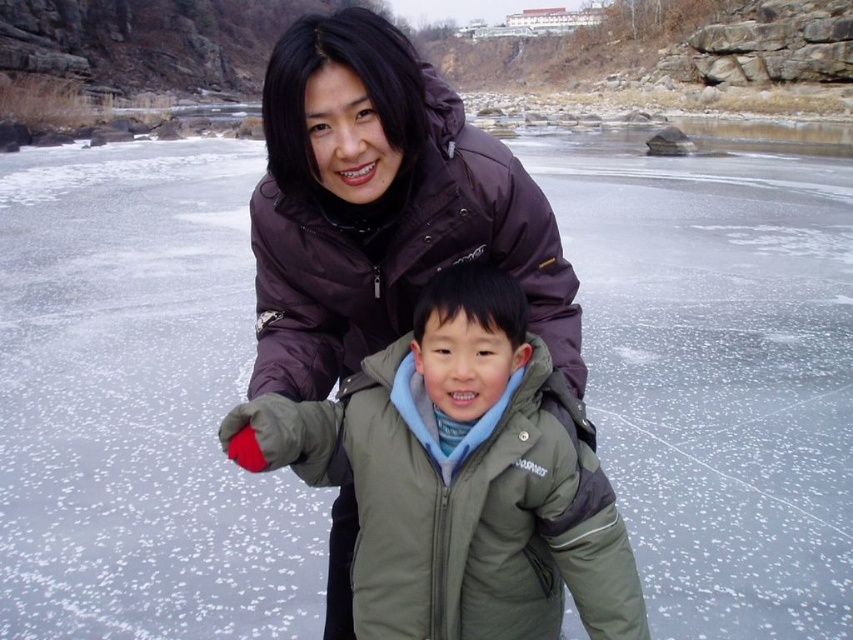
In the winter scene, there is a woman in a dark purple puffer jacket and a boy in a green fuzzy jacket at center. Where exactly is the green fuzzy jacket located in terms of coordinates?

The green fuzzy jacket at center is located at point coordinates of [460,476].

You are a photographer trying to capture a photo of both the green fuzzy jacket at center and the dark purple down jacket at center. Which jacket will appear larger in the photo if you focus on the closer one?

The dark purple down jacket at center will appear larger in the photo because it is taller than the green fuzzy jacket at center.

You are a photographer trying to capture both the green fuzzy jacket at center and the dark purple down jacket at center in the same frame. Which jacket should you focus on first to ensure both are in the frame?

The green fuzzy jacket at center is smaller in size compared to the dark purple down jacket at center. To ensure both are in the frame, focus on the larger dark purple down jacket at center first, then adjust to include the smaller green fuzzy jacket at center.